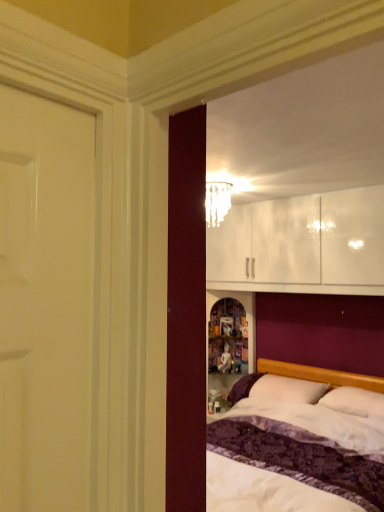
Question: Considering the relative sizes of white soft pillow at center, arranged as the second pillow when viewed from the left, and white soft pillow at lower right, the second pillow in the right-to-left sequence, in the image provided, is white soft pillow at center, arranged as the second pillow when viewed from the left, shorter than white soft pillow at lower right, the second pillow in the right-to-left sequence,?

Choices:
 (A) no
 (B) yes

Answer: (B)

Question: Is white soft pillow at center, arranged as the second pillow when viewed from the left, positioned with its back to white soft pillow at lower right, the first pillow when ordered from left to right?

Choices:
 (A) yes
 (B) no

Answer: (B)

Question: Is the surface of white soft pillow at center, which ranks as the first pillow in right-to-left order, in direct contact with white soft pillow at lower right, the first pillow when ordered from left to right?

Choices:
 (A) no
 (B) yes

Answer: (A)

Question: From the image's perspective, is white soft pillow at center, arranged as the second pillow when viewed from the left, located above white soft pillow at lower right, the second pillow in the right-to-left sequence?

Choices:
 (A) yes
 (B) no

Answer: (A)

Question: Is white soft pillow at center, arranged as the second pillow when viewed from the left, aimed at white soft pillow at lower right, the first pillow when ordered from left to right?

Choices:
 (A) yes
 (B) no

Answer: (B)

Question: Does white soft pillow at center, which ranks as the first pillow in right-to-left order, lie in front of white soft pillow at lower right, the first pillow when ordered from left to right?

Choices:
 (A) no
 (B) yes

Answer: (B)

Question: Is translucent glass chandelier at upper center facing away from white soft pillow at lower right, the second pillow in the right-to-left sequence?

Choices:
 (A) yes
 (B) no

Answer: (B)

Question: Is the depth of translucent glass chandelier at upper center greater than that of white soft pillow at lower right, the second pillow in the right-to-left sequence?

Choices:
 (A) yes
 (B) no

Answer: (B)

Question: Is white soft pillow at lower right, the first pillow when ordered from left to right, completely or partially inside translucent glass chandelier at upper center?

Choices:
 (A) no
 (B) yes

Answer: (A)

Question: Is translucent glass chandelier at upper center with white soft pillow at lower right, the first pillow when ordered from left to right?

Choices:
 (A) no
 (B) yes

Answer: (A)

Question: Is translucent glass chandelier at upper center smaller than white soft pillow at lower right, the first pillow when ordered from left to right?

Choices:
 (A) no
 (B) yes

Answer: (B)

Question: Is translucent glass chandelier at upper center at the left side of white soft pillow at lower right, the first pillow when ordered from left to right?

Choices:
 (A) yes
 (B) no

Answer: (A)

Question: Can you see translucent glass chandelier at upper center touching white soft pillow at center, which ranks as the first pillow in right-to-left order?

Choices:
 (A) yes
 (B) no

Answer: (B)